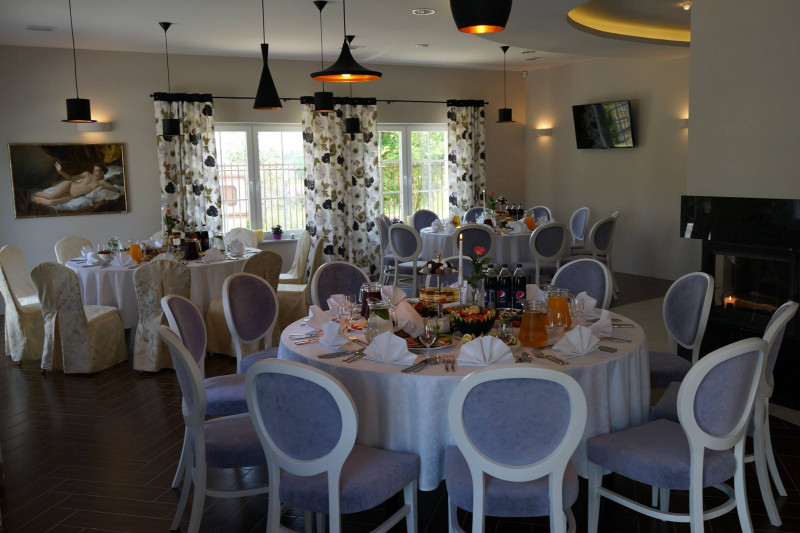
Where is `slipcover`? The image size is (800, 533). slipcover is located at coordinates (268, 266), (249, 237), (170, 276), (68, 246), (21, 317), (78, 334).